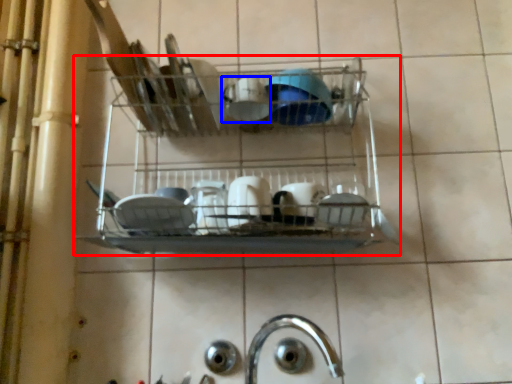
Question: Among these objects, which one is nearest to the camera, shelf (highlighted by a red box) or tableware (highlighted by a blue box)?

Choices:
 (A) shelf
 (B) tableware

Answer: (A)